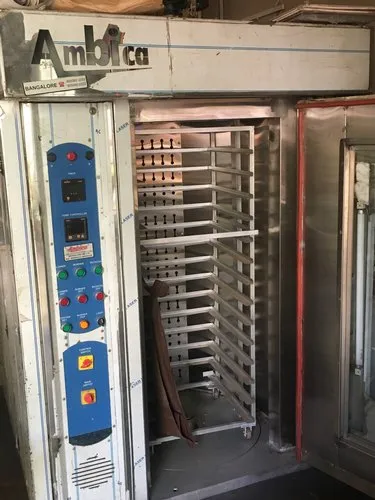
You are a GUI agent. You are given a task and a screenshot of the screen. Output one action in this format:
    pyautogui.click(x=<x>, y=<y>)
    Task: Click on the red lights
    This screenshot has height=500, width=375.
    Given the screenshot: What is the action you would take?
    pyautogui.click(x=66, y=301), pyautogui.click(x=81, y=300), pyautogui.click(x=100, y=296)